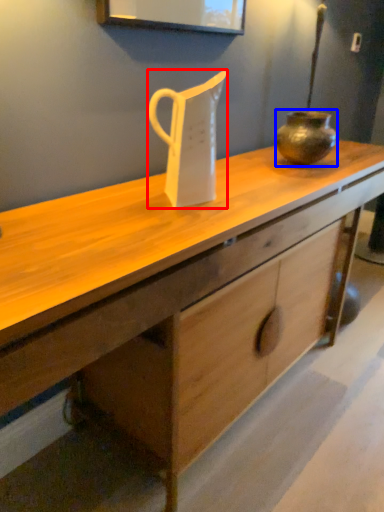
Question: Which object is further to the camera taking this photo, jug (highlighted by a red box) or vase (highlighted by a blue box)?

Choices:
 (A) jug
 (B) vase

Answer: (B)